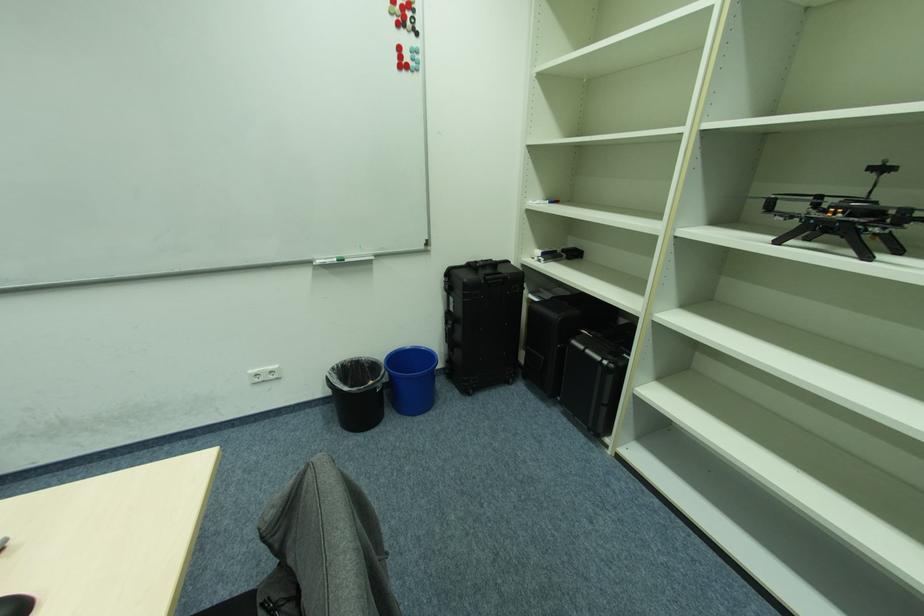
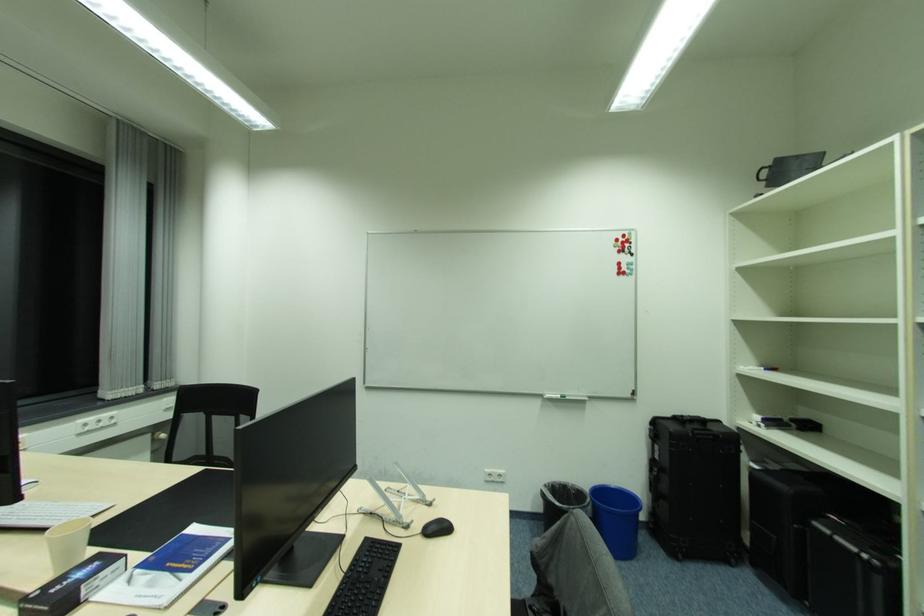
In the scene shown: Based on the continuous images, in which direction is the camera rotating?

The camera's rotation is toward left-up.